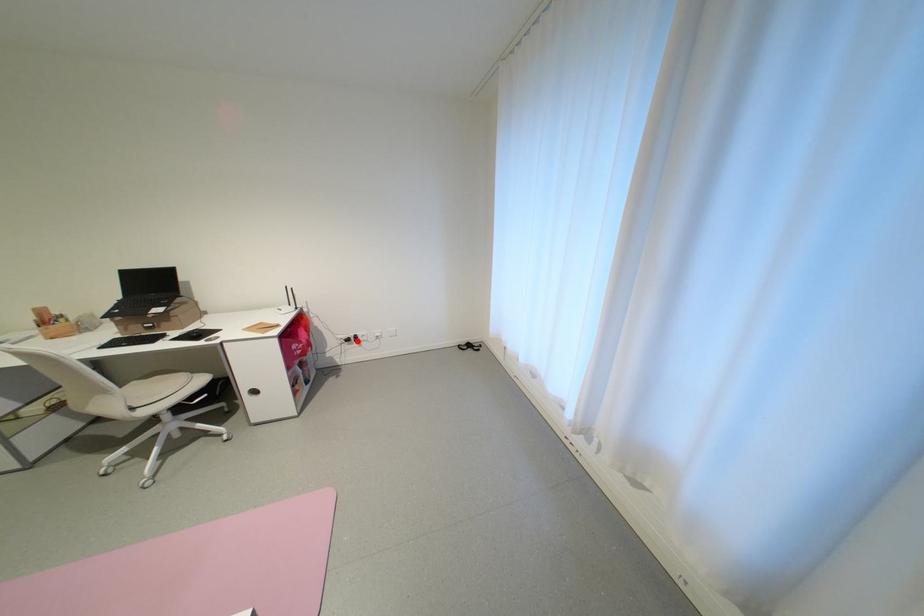
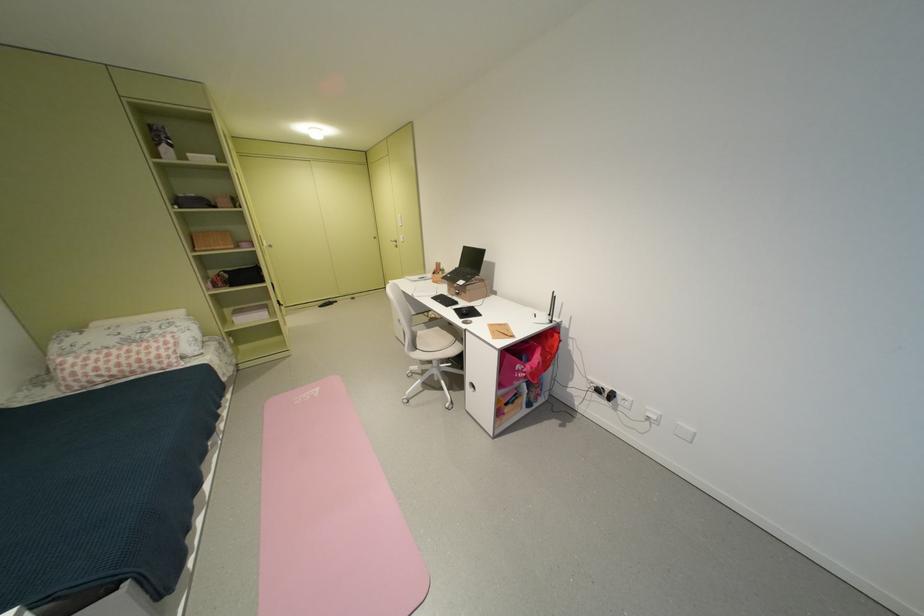
In the second image, find the point that corresponds to the highlighted location in the first image.

(609, 392)